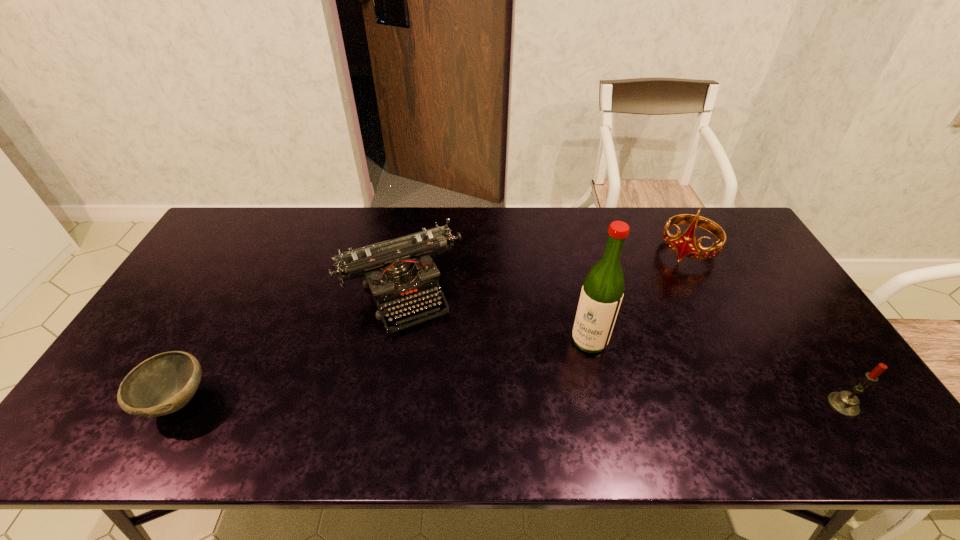
Where is `vacant space at the left edge`? vacant space at the left edge is located at coordinates (x=216, y=286).

In the image, there is a desktop. In order to click on free space at the right edge in this screenshot , I will do `click(738, 258)`.

In the image, there is a desktop. Where is `vacant space at the far left corner`? vacant space at the far left corner is located at coordinates (257, 231).

Where is `vacant space at the far right corner of the desktop`? The width and height of the screenshot is (960, 540). vacant space at the far right corner of the desktop is located at coordinates [732, 224].

In the image, there is a desktop. At what (x,y) coordinates should I click in order to perform the action: click on vacant region at the near right corner. Please return your answer as a coordinate pair (x, y). The height and width of the screenshot is (540, 960). Looking at the image, I should click on (843, 388).

This screenshot has height=540, width=960. What are the coordinates of `empty space between the rightmost object and the third object from left to right` in the screenshot? It's located at (716, 373).

I want to click on free spot between the third object from left to right and the bowl, so click(x=384, y=371).

Image resolution: width=960 pixels, height=540 pixels. What are the coordinates of `vacant point located between the candle and the second object from left to right` in the screenshot? It's located at coord(622,348).

The image size is (960, 540). What are the coordinates of `empty location between the liquor and the candle` in the screenshot? It's located at (716, 373).

Locate an element on the screen. The width and height of the screenshot is (960, 540). free space between the third object from right to left and the second tallest object is located at coordinates (638, 295).